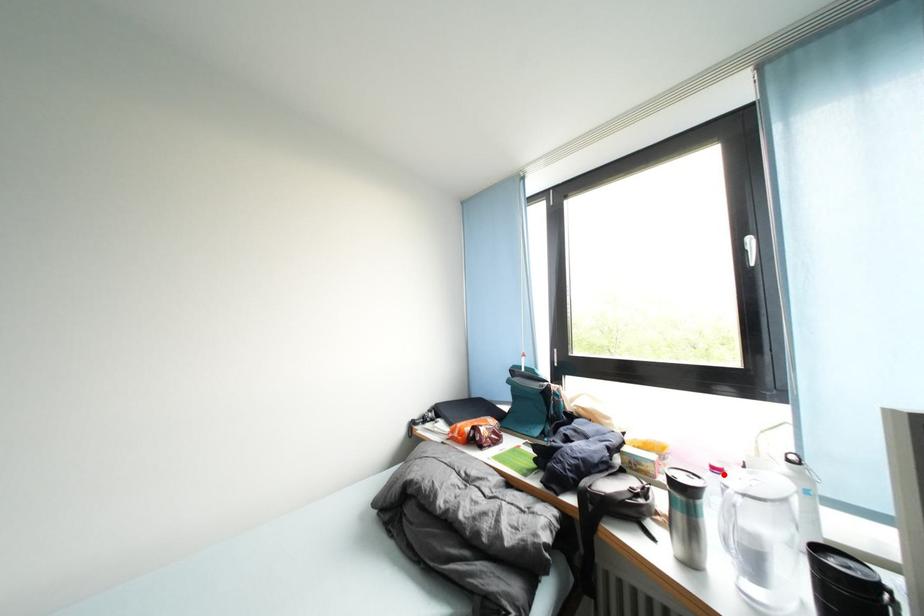
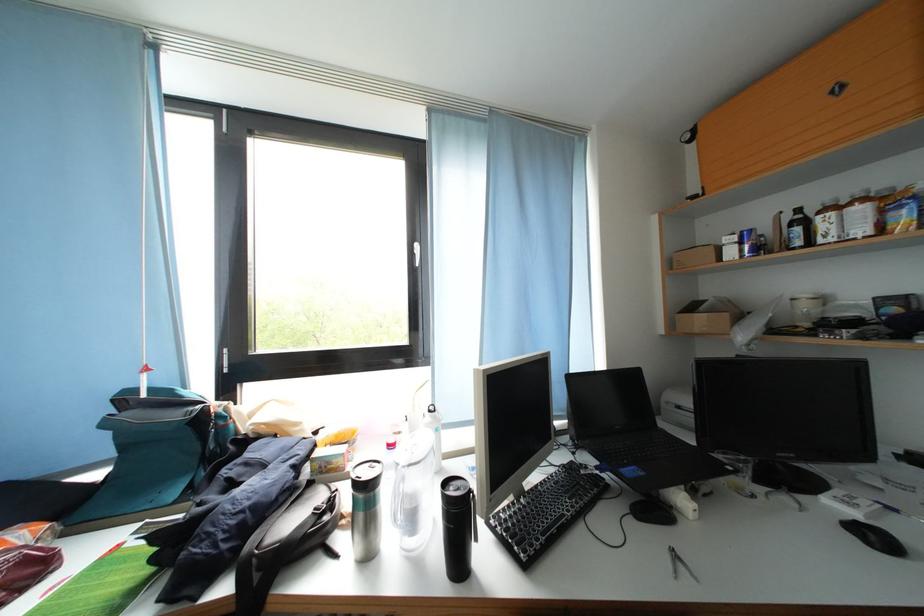
Question: I am providing you with two images of the same scene from different viewpoints. A red point is shown in image1. For the corresponding object point in image2, is it positioned nearer or farther from the camera?

Choices:
 (A) Nearer
 (B) Farther

Answer: (A)